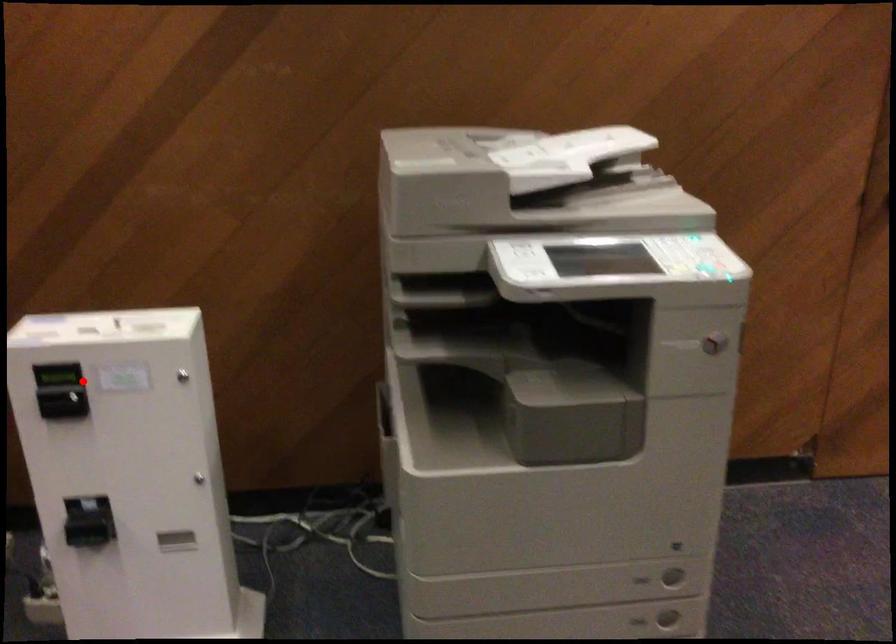
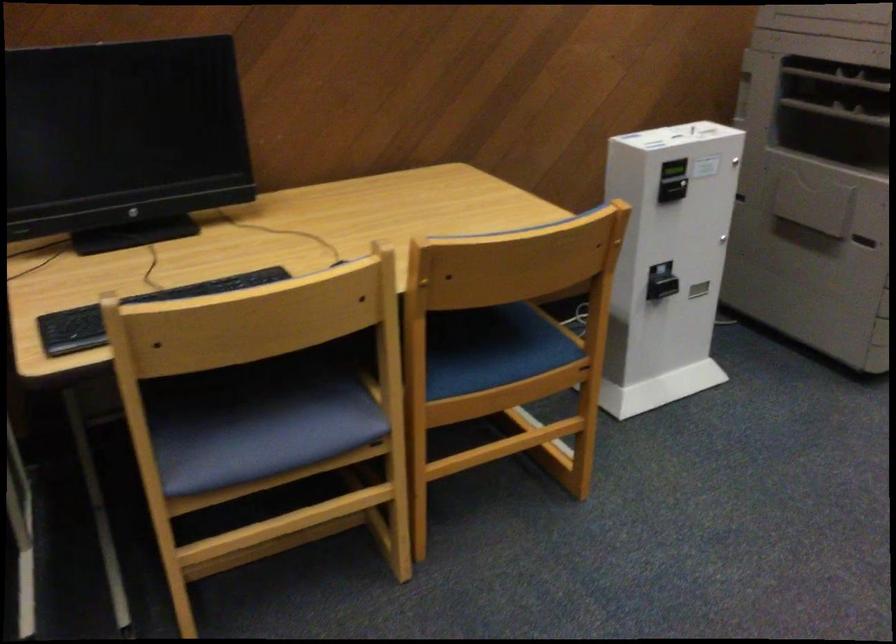
In the second image, find the point that corresponds to the highlighted location in the first image.

(673, 169)